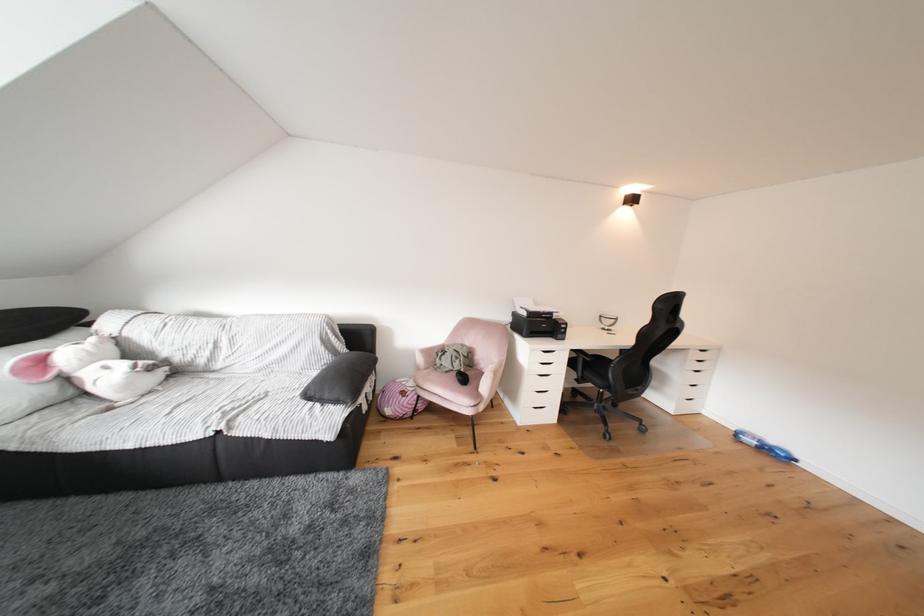
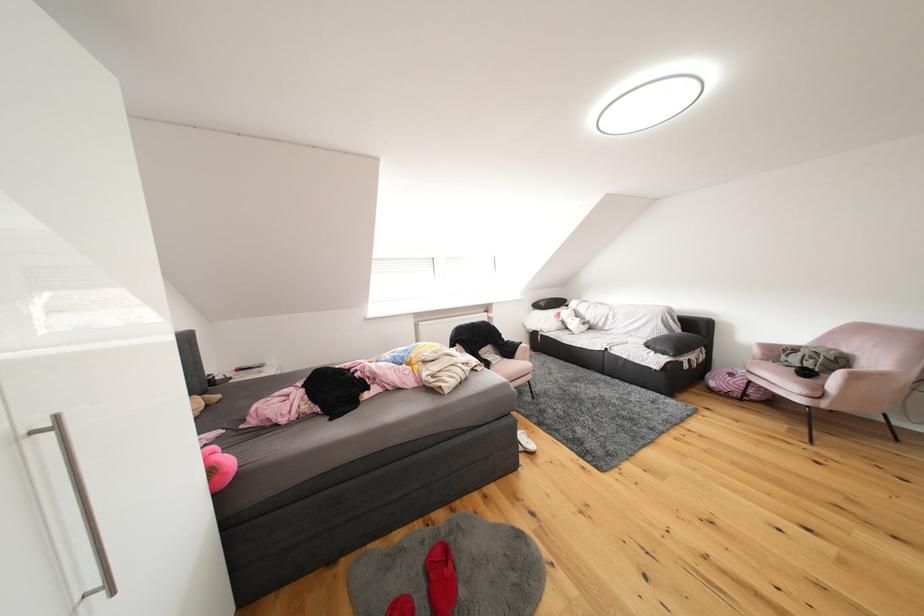
Locate, in the second image, the point that corresponds to (412,397) in the first image.

(740, 379)